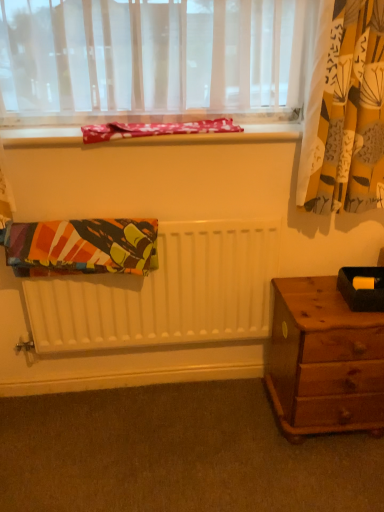
At what (x,y) coordinates should I click in order to perform the action: click on vacant area situated below white matte radiator at center (from a real-world perspective). Please return your answer as a coordinate pair (x, y). The image size is (384, 512). Looking at the image, I should click on (141, 384).